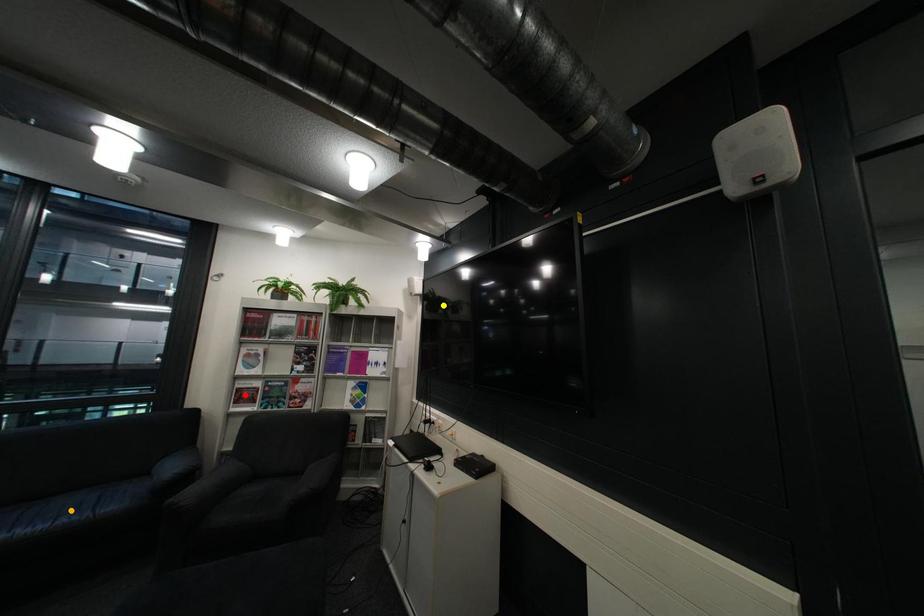
Order these from farthest to nearest:
yellow point
red point
orange point

1. yellow point
2. red point
3. orange point